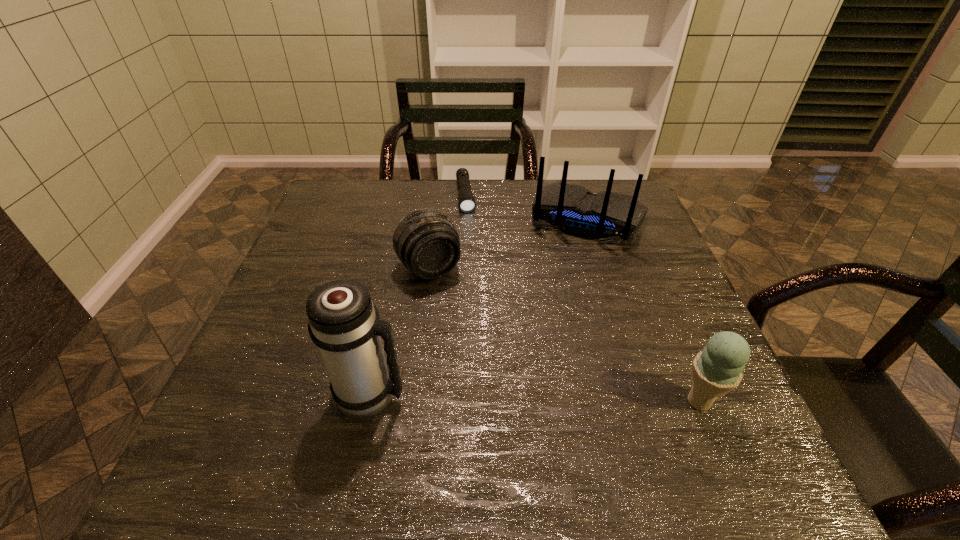
You are a GUI agent. You are given a task and a screenshot of the screen. Output one action in this format:
    pyautogui.click(x=<x>, y=<y>)
    Task: Click on the unoccupied area between the telephoto lens and the router
    The width and height of the screenshot is (960, 540).
    Given the screenshot: What is the action you would take?
    pyautogui.click(x=509, y=244)

The height and width of the screenshot is (540, 960). I want to click on free space that is in between the shortest object and the router, so click(x=527, y=208).

Locate an element on the screen. free space that is in between the tallest object and the router is located at coordinates (479, 307).

Where is `free space between the tallest object and the router`? The image size is (960, 540). free space between the tallest object and the router is located at coordinates (479, 307).

Identify the location of vacant point located between the thermos bottle and the second tallest object. The height and width of the screenshot is (540, 960). (479, 307).

Find the location of `free space that is in between the thermos bottle and the telephoto lens`. free space that is in between the thermos bottle and the telephoto lens is located at coordinates (400, 331).

Identify the location of vacant space that is in between the flashlight and the thermos bottle. (418, 295).

What are the coordinates of `free point between the flashlight and the tallest object` in the screenshot? It's located at (418, 295).

Locate an element on the screen. The height and width of the screenshot is (540, 960). vacant area that lies between the telephoto lens and the tallest object is located at coordinates (400, 331).

The height and width of the screenshot is (540, 960). I want to click on blank region between the thermos bottle and the flashlight, so click(418, 295).